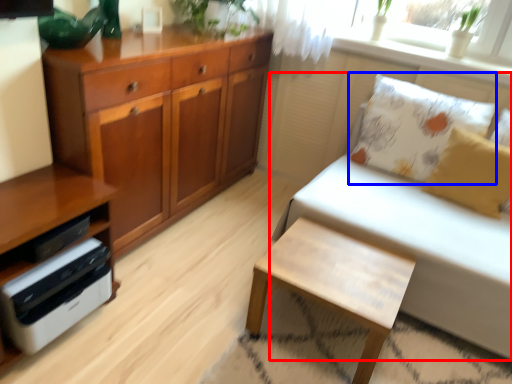
Question: Which of the following is the closest to the observer, studio couch (highlighted by a red box) or pillow (highlighted by a blue box)?

Choices:
 (A) studio couch
 (B) pillow

Answer: (A)